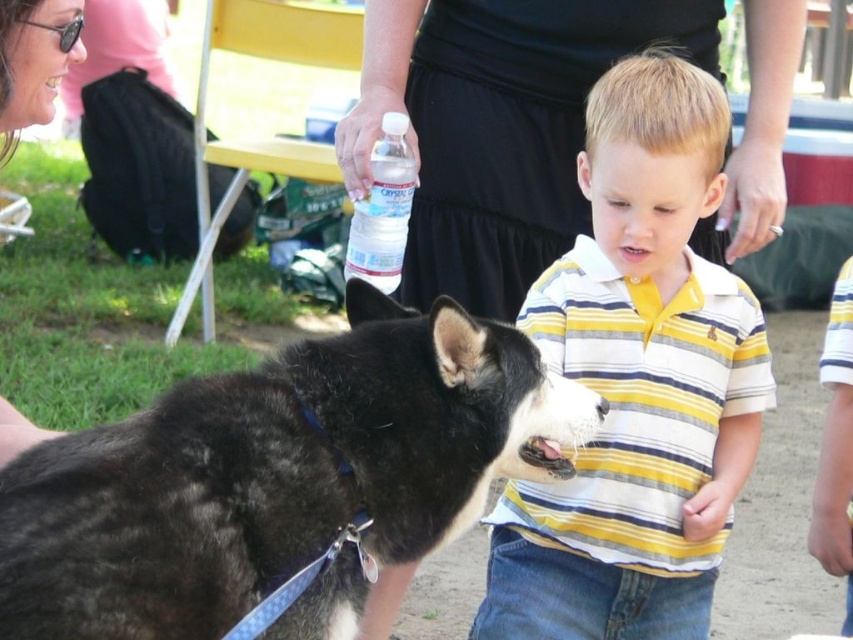
Between yellow striped polo shirt at center and matte black nose at upper left, which one is positioned higher?

matte black nose at upper left is higher up.

Between yellow striped polo shirt at center and matte black nose at upper left, which one is positioned lower?

yellow striped polo shirt at center is lower down.

Identify the location of yellow striped polo shirt at center. The image size is (853, 640). (637, 381).

Which of these two, black fur dog at center or yellow striped polo shirt at center, stands shorter?

With less height is black fur dog at center.

Does black fur dog at center lie in front of yellow striped polo shirt at center?

Yes, it is.

Does point (206, 474) lie behind point (635, 557)?

No, it is in front of (635, 557).

You are a GUI agent. You are given a task and a screenshot of the screen. Output one action in this format:
    pyautogui.click(x=<x>, y=<y>)
    Task: Click on the black fur dog at center
    This screenshot has height=640, width=853.
    Given the screenshot: What is the action you would take?
    pyautogui.click(x=276, y=474)

Between black fur dog at center and clear plastic water bottle at center, which one has less height?

Standing shorter between the two is clear plastic water bottle at center.

This screenshot has height=640, width=853. Find the location of `black fur dog at center`. black fur dog at center is located at coordinates (276, 474).